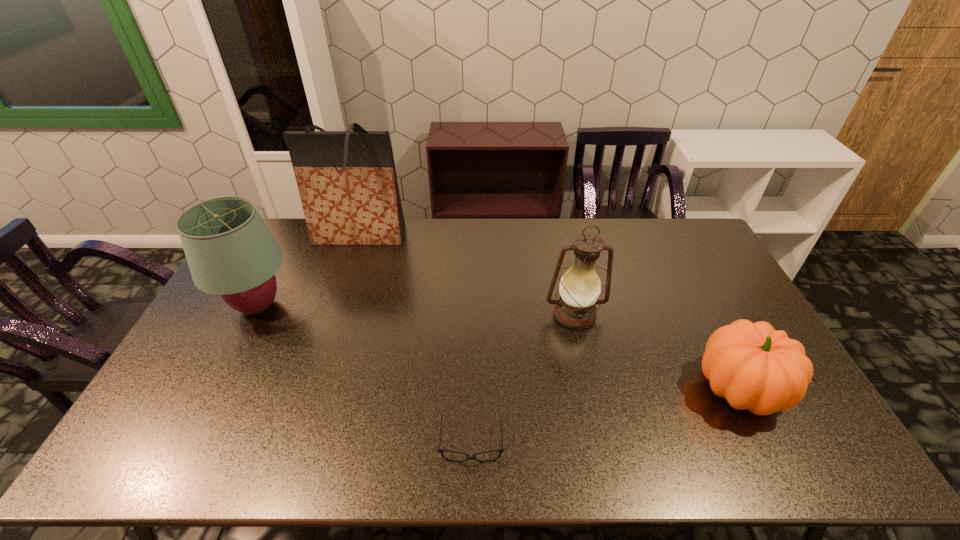
Where is `the tallest object`? the tallest object is located at coordinates (347, 181).

This screenshot has height=540, width=960. In order to click on the farthest object in this screenshot , I will do `click(347, 181)`.

You are a GUI agent. You are given a task and a screenshot of the screen. Output one action in this format:
    pyautogui.click(x=<x>, y=<y>)
    Task: Click on the lampshade
    The width and height of the screenshot is (960, 540).
    Given the screenshot: What is the action you would take?
    pyautogui.click(x=230, y=252)

At what (x,y) coordinates should I click in order to perform the action: click on the second object from right to left. Please return your answer as a coordinate pair (x, y). Looking at the image, I should click on (580, 287).

Identify the location of the rightmost object. (755, 367).

This screenshot has height=540, width=960. Identify the location of the fourth tallest object. (755, 367).

Locate an element on the screen. The image size is (960, 540). the shortest object is located at coordinates (441, 451).

You are a GUI agent. You are given a task and a screenshot of the screen. Output one action in this format:
    pyautogui.click(x=<x>, y=<y>)
    Task: Click on the third object from right to left
    The height and width of the screenshot is (540, 960).
    Given the screenshot: What is the action you would take?
    pyautogui.click(x=441, y=451)

Locate an element on the screen. The width and height of the screenshot is (960, 540). vacant space located on the front-facing side of the shopping bag is located at coordinates (341, 289).

Locate an element on the screen. This screenshot has width=960, height=540. free space located 0.270m on the right of the lampshade is located at coordinates (380, 306).